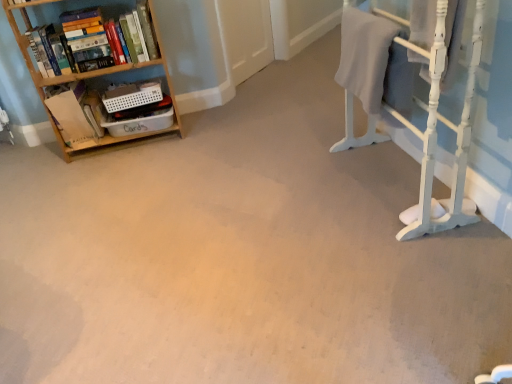
Identify the location of vacant space underneath white painted wood bunk bed at right (from a real-world perspective). The image size is (512, 384). (377, 179).